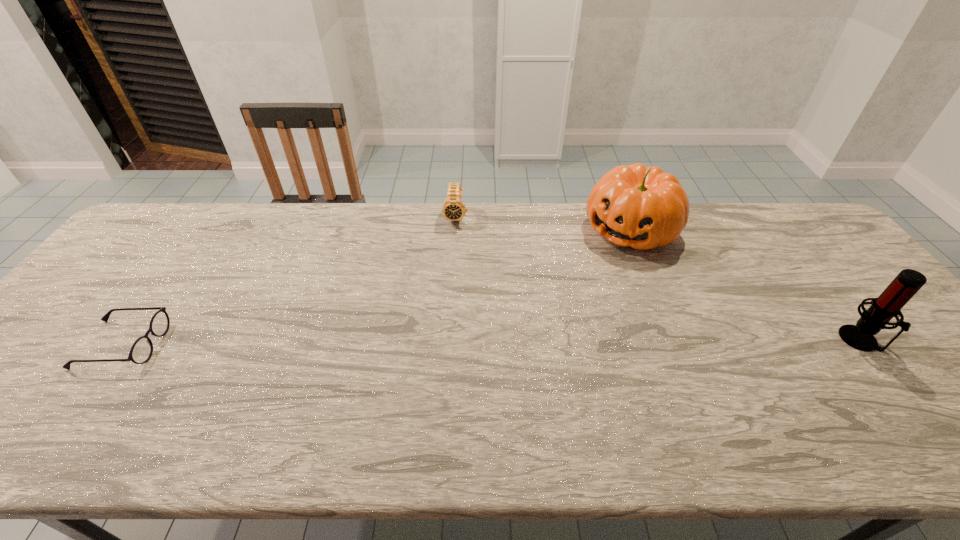
Find the location of a particular element. The image size is (960, 540). spectacles is located at coordinates (141, 351).

Identify the location of the shortest object. The width and height of the screenshot is (960, 540). (141, 351).

Image resolution: width=960 pixels, height=540 pixels. I want to click on microphone, so [x=908, y=282].

The height and width of the screenshot is (540, 960). In order to click on pumpkin in this screenshot , I will do `click(644, 208)`.

Image resolution: width=960 pixels, height=540 pixels. What are the coordinates of `watch` in the screenshot? It's located at (453, 209).

This screenshot has height=540, width=960. I want to click on the third tallest object, so click(x=453, y=209).

At what (x,y) coordinates should I click in order to perform the action: click on free location located on the front-facing side of the spectacles. Please return your answer as a coordinate pair (x, y). Looking at the image, I should click on (225, 345).

Where is `vacant space situated on the right of the microphone`? vacant space situated on the right of the microphone is located at coordinates (918, 340).

Where is `vacant space situated on the carved face of the second object from right to left`? This screenshot has width=960, height=540. vacant space situated on the carved face of the second object from right to left is located at coordinates (556, 325).

Where is `free spot located on the carved face of the second object from right to left`? The width and height of the screenshot is (960, 540). free spot located on the carved face of the second object from right to left is located at coordinates (601, 267).